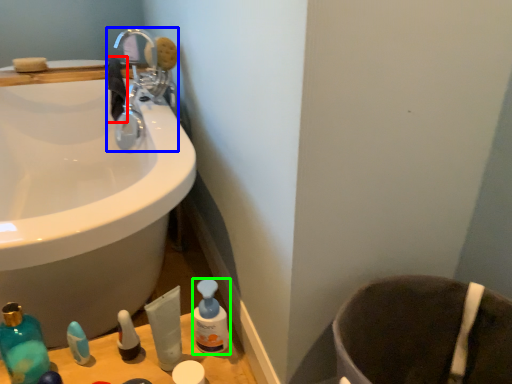
Question: Which is nearer to the hand towel (highlighted by a red box)? tap (highlighted by a blue box) or cleaning product (highlighted by a green box).

Choices:
 (A) tap
 (B) cleaning product

Answer: (A)